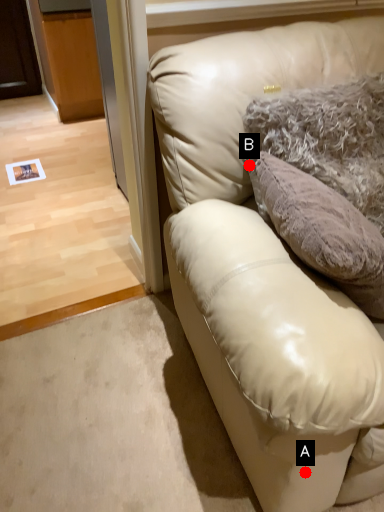
Question: Two points are circled on the image, labeled by A and B beside each circle. Which point is closer to the camera?

Choices:
 (A) A is closer
 (B) B is closer

Answer: (A)